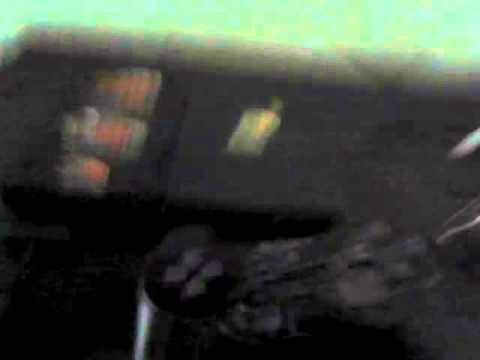
You are a GUI agent. You are given a task and a screenshot of the screen. Output one action in this format:
    pyautogui.click(x=<x>, y=<y>)
    Task: Click on the blurred gaming controller
    The height and width of the screenshot is (360, 480).
    Given the screenshot: What is the action you would take?
    pyautogui.click(x=225, y=296)